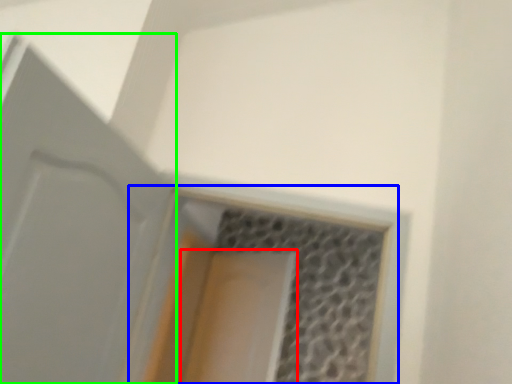
Question: Which object is the closest to the screen door (highlighted by a red box)? Choose among these: window (highlighted by a blue box) or door (highlighted by a green box).

Choices:
 (A) window
 (B) door

Answer: (A)